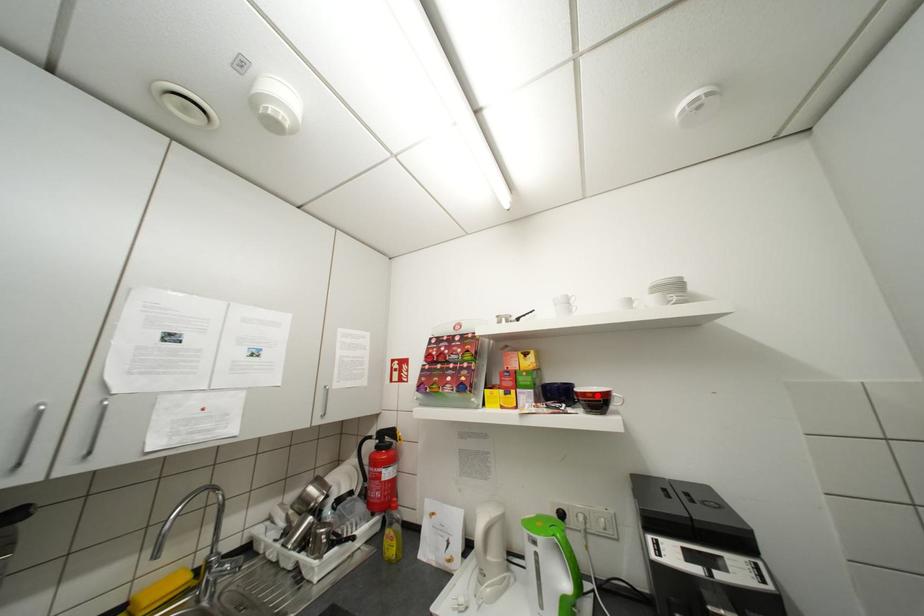
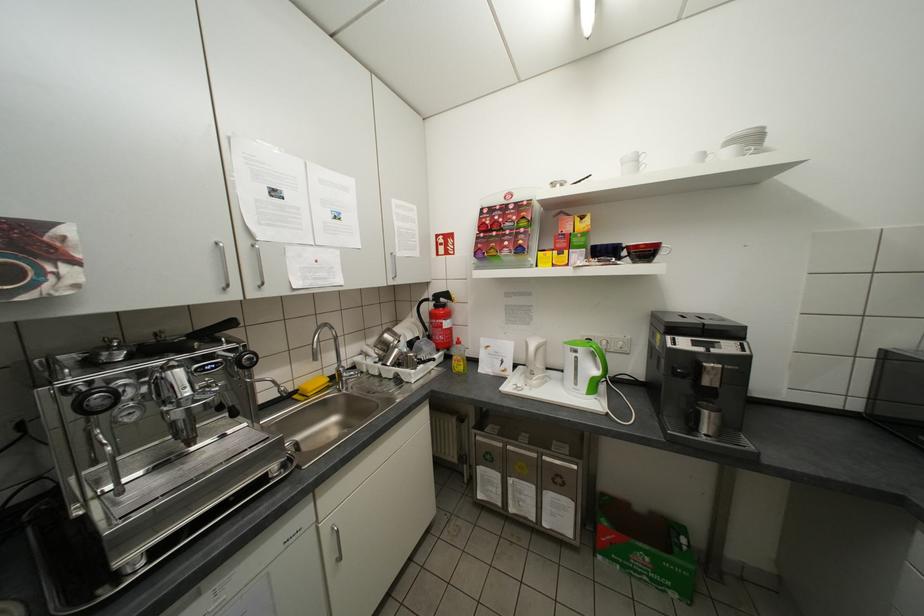
Locate, in the second image, the point that corresponds to the highlighted location in the first image.

(650, 246)